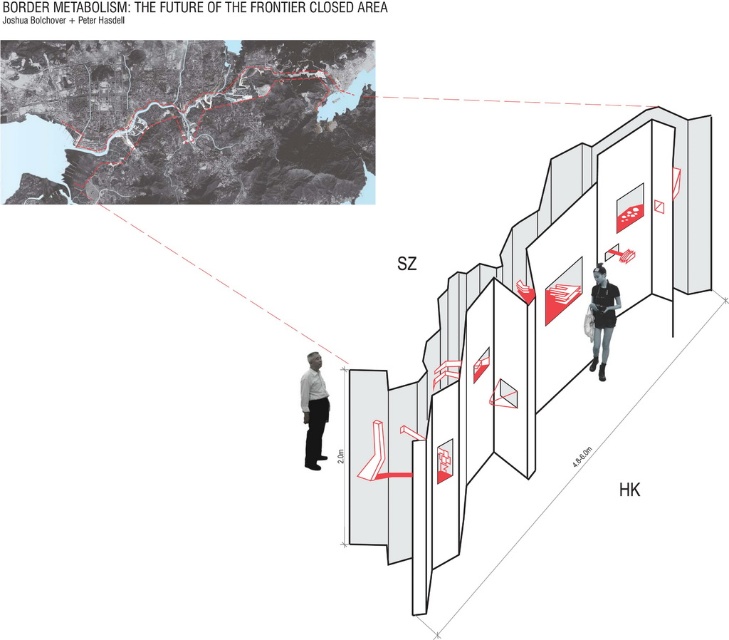
Question: In this image, where is white matte shirt at lower left located relative to black matte shirt at center?

Choices:
 (A) below
 (B) above

Answer: (A)

Question: Is white matte shirt at lower left bigger than black matte shirt at center?

Choices:
 (A) no
 (B) yes

Answer: (A)

Question: Does white matte shirt at lower left come in front of black matte shirt at center?

Choices:
 (A) yes
 (B) no

Answer: (B)